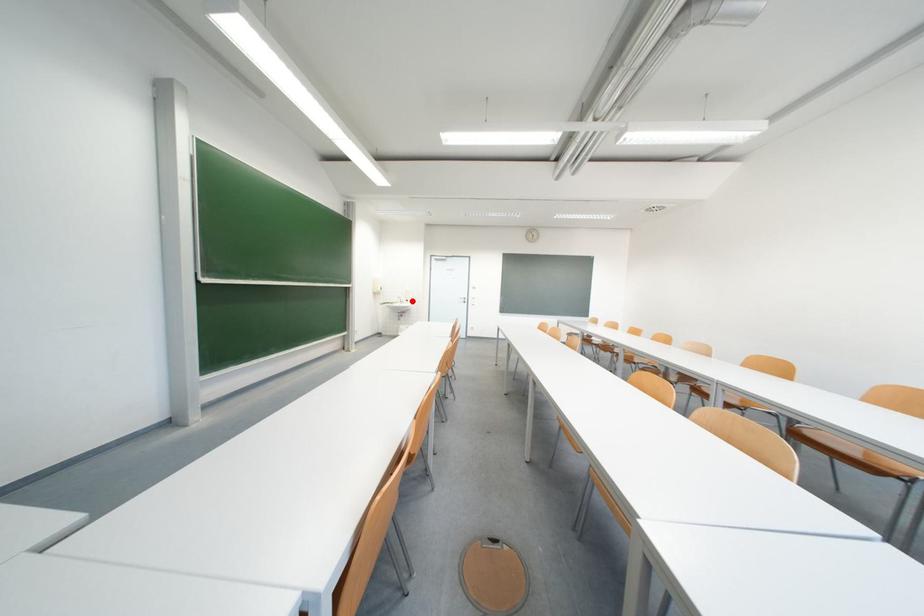
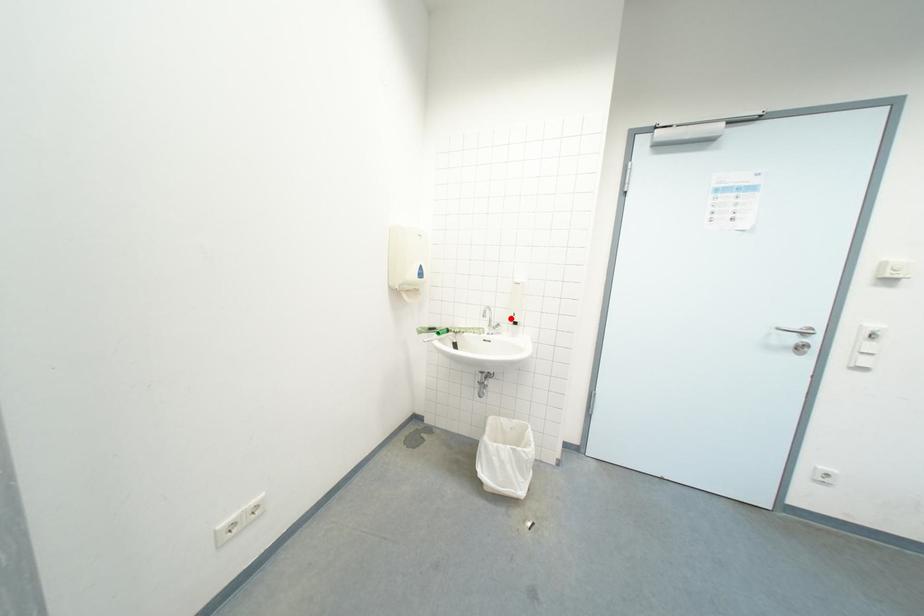
I am providing you with two images of the same scene from different viewpoints. A red point is marked on the first image and another point is marked on the second image. Do the highlighted points in image1 and image2 indicate the same real-world spot?

Yes